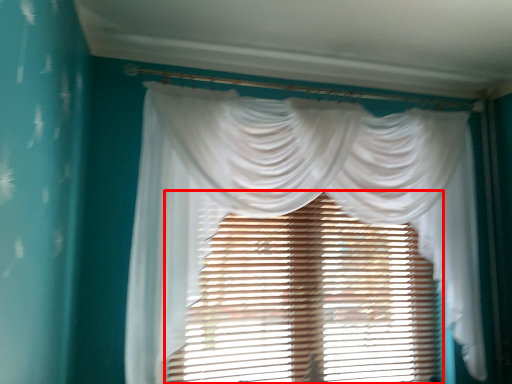
Question: Where is window blind (annotated by the red box) located in relation to curtain in the image?

Choices:
 (A) right
 (B) left

Answer: (B)